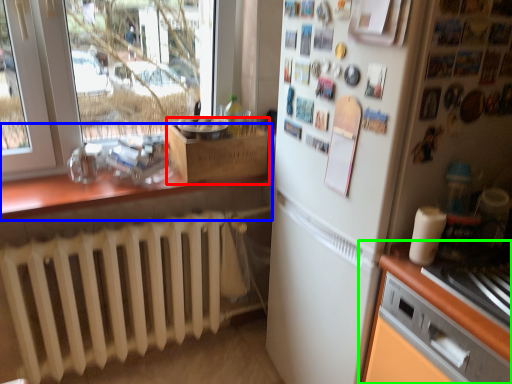
Question: Considering the real-world distances, which object is closest to cardboard box (highlighted by a red box)? countertop (highlighted by a blue box) or cabinetry (highlighted by a green box).

Choices:
 (A) countertop
 (B) cabinetry

Answer: (A)